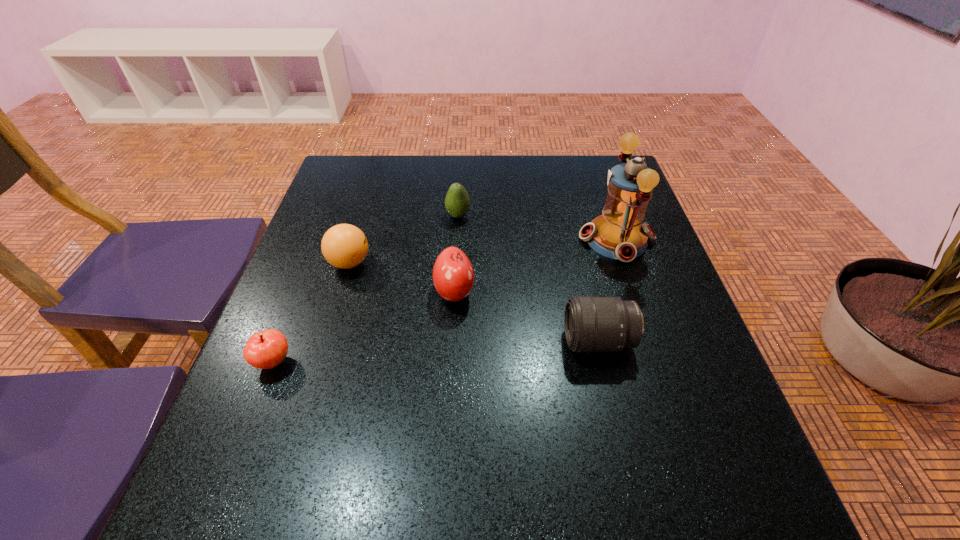
Locate an element on the screen. This screenshot has width=960, height=540. vacant area between the telephoto lens and the farther apple is located at coordinates (526, 316).

At what (x,y) coordinates should I click in order to perform the action: click on free space between the ping-pong ball and the tallest object. Please return your answer as a coordinate pair (x, y). The width and height of the screenshot is (960, 540). Looking at the image, I should click on (483, 251).

Find the location of `vacant space that's between the taller apple and the telephoto lens`. vacant space that's between the taller apple and the telephoto lens is located at coordinates (526, 316).

Identify the location of free spot between the avocado and the lantern. The width and height of the screenshot is (960, 540). (538, 227).

What are the coordinates of `vacant space that's between the nearer apple and the tallest object` in the screenshot? It's located at (444, 301).

This screenshot has height=540, width=960. I want to click on free spot between the lantern and the ping-pong ball, so click(x=483, y=251).

Identify which object is the third nearest to the avocado. Please provide its 2D coordinates. Your answer should be formatted as a tuple, i.e. [(x, y)], where the tuple contains the x and y coordinates of a point satisfying the conditions above.

[(618, 233)]

What are the coordinates of `the fifth closest object to the ping-pong ball` in the screenshot? It's located at (618, 233).

The height and width of the screenshot is (540, 960). I want to click on blank area in the image that satisfies the following two spatial constraints: 1. on the side with brand of the ping-pong ball; 2. on the left side of the farther apple, so click(341, 292).

Locate an element on the screen. This screenshot has height=540, width=960. vacant region that satisfies the following two spatial constraints: 1. on the front side of the avocado; 2. on the side with brand of the ping-pong ball is located at coordinates (455, 263).